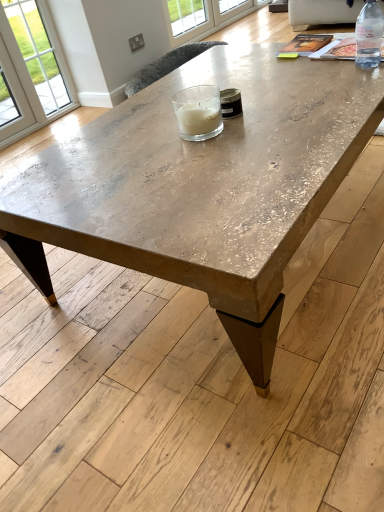
Question: Considering the relative sizes of clear plastic bottle at upper right and clear glass candle at center in the image provided, is clear plastic bottle at upper right shorter than clear glass candle at center?

Choices:
 (A) no
 (B) yes

Answer: (A)

Question: Does clear plastic bottle at upper right have a greater height compared to clear glass candle at center?

Choices:
 (A) no
 (B) yes

Answer: (B)

Question: Considering the relative positions of clear plastic bottle at upper right and clear glass candle at center in the image provided, is clear plastic bottle at upper right to the left of clear glass candle at center from the viewer's perspective?

Choices:
 (A) no
 (B) yes

Answer: (A)

Question: Is clear plastic bottle at upper right bigger than clear glass candle at center?

Choices:
 (A) no
 (B) yes

Answer: (A)

Question: Does clear plastic bottle at upper right appear on the right side of clear glass candle at center?

Choices:
 (A) yes
 (B) no

Answer: (A)

Question: Is point (360, 148) positioned closer to the camera than point (225, 16)?

Choices:
 (A) closer
 (B) farther

Answer: (A)

Question: In the image, is distressed wood coffee table at center positioned in front of or behind clear glass window at upper center?

Choices:
 (A) front
 (B) behind

Answer: (A)

Question: Based on their sizes in the image, would you say distressed wood coffee table at center is bigger or smaller than clear glass window at upper center?

Choices:
 (A) small
 (B) big

Answer: (B)

Question: From the image's perspective, relative to clear glass window at upper center, is distressed wood coffee table at center above or below?

Choices:
 (A) below
 (B) above

Answer: (A)

Question: Is beige fabric couch at upper right in front of or behind distressed wood coffee table at center in the image?

Choices:
 (A) behind
 (B) front

Answer: (A)

Question: From a real-world perspective, is beige fabric couch at upper right above or below distressed wood coffee table at center?

Choices:
 (A) above
 (B) below

Answer: (B)

Question: Based on their sizes in the image, would you say beige fabric couch at upper right is bigger or smaller than distressed wood coffee table at center?

Choices:
 (A) big
 (B) small

Answer: (B)

Question: Is beige fabric couch at upper right taller or shorter than distressed wood coffee table at center?

Choices:
 (A) tall
 (B) short

Answer: (B)

Question: Considering the positions of clear glass window at upper center and beige fabric couch at upper right in the image, is clear glass window at upper center bigger or smaller than beige fabric couch at upper right?

Choices:
 (A) big
 (B) small

Answer: (B)

Question: Based on their positions, is clear glass window at upper center located to the left or right of beige fabric couch at upper right?

Choices:
 (A) left
 (B) right

Answer: (A)